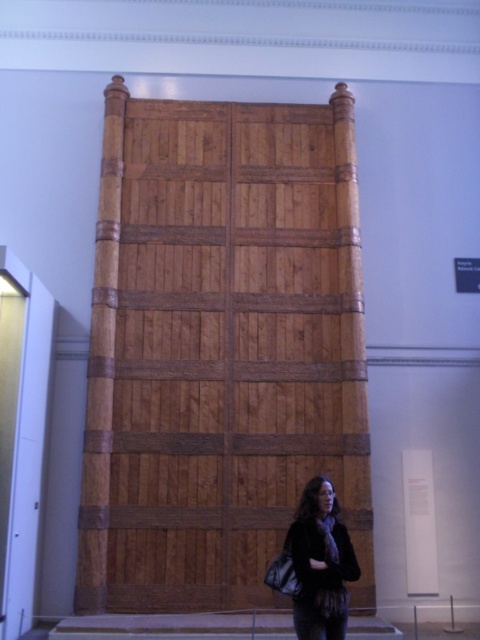
Question: Does natural wood door at center have a lesser width compared to dark brown leather jacket at lower center?

Choices:
 (A) yes
 (B) no

Answer: (B)

Question: Is the position of natural wood door at center more distant than that of dark brown leather jacket at lower center?

Choices:
 (A) yes
 (B) no

Answer: (A)

Question: Considering the relative positions of natural wood door at center and dark brown leather jacket at lower center in the image provided, where is natural wood door at center located with respect to dark brown leather jacket at lower center?

Choices:
 (A) below
 (B) above

Answer: (B)

Question: Which point is closer to the camera taking this photo?

Choices:
 (A) (210, 102)
 (B) (314, 488)

Answer: (B)